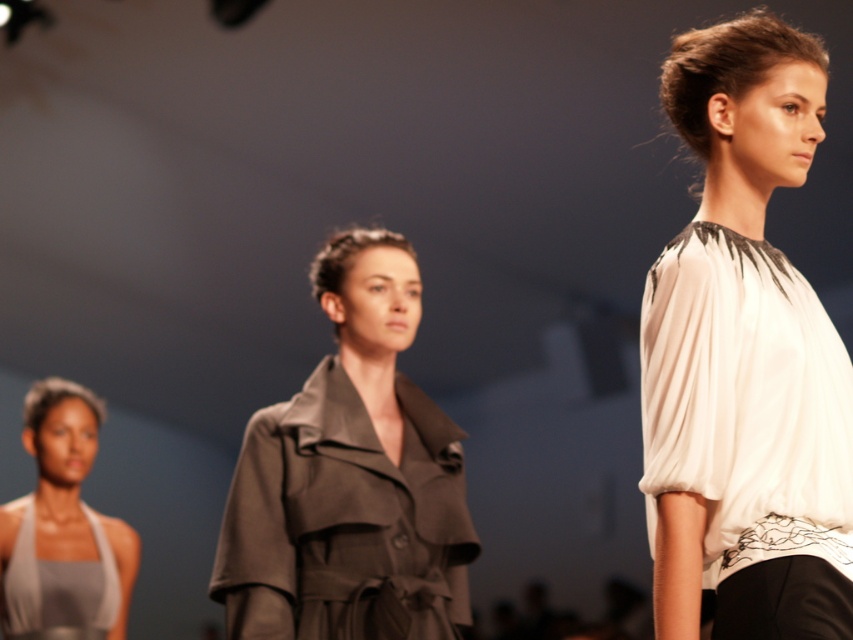
You are a photographer at the runway show. You want to capture a closeup of the model wearing the white silk blouse at right. The camera you are using has a focal length of 85mm. Given that the model is at point 0.558, 0.875 in the frame, can you estimate whether the blouse will be in the center of the frame or off to the side?

The white silk blouse at right is located at coordinates [746,356] in the frame. Since the coordinates are not at the center point of the frame, the blouse will appear off to the side rather than centered in the photo.

You are a photographer at the runway show and want to focus your camera on the white silk blouse at right. The camera can only focus on objects within a 0.1 unit radius of the point specified. Is the point at coordinates point (746,356) suitable for focusing on the white silk blouse at right?

Yes, the point at coordinates point (746,356) is suitable because it directly corresponds to the white silk blouse at right, ensuring accurate focus on the desired object.